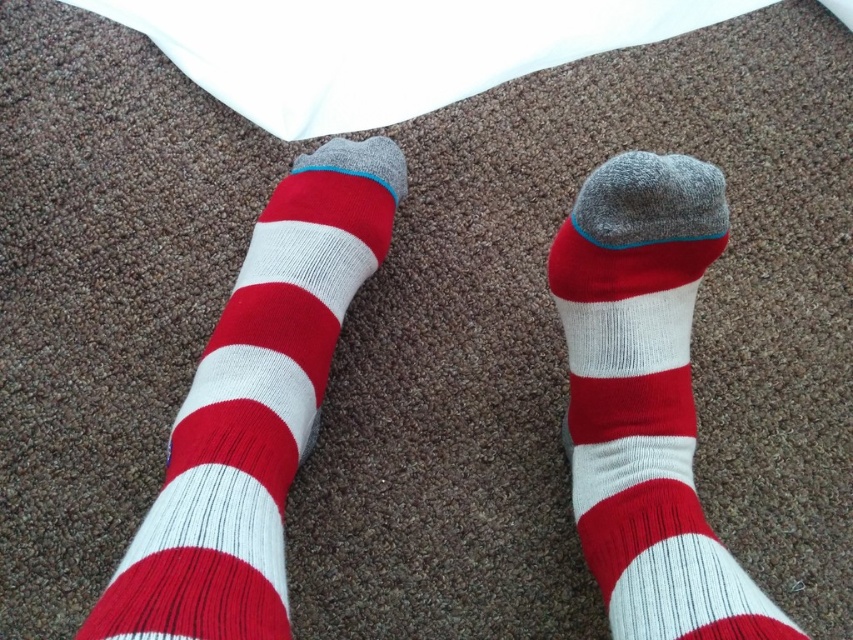
You are standing in a room with a textured brown carpet and see a point at coordinates (x=254, y=410). What object is located at that point?

The point at coordinates (x=254, y=410) corresponds to the red and white striped sock at center.